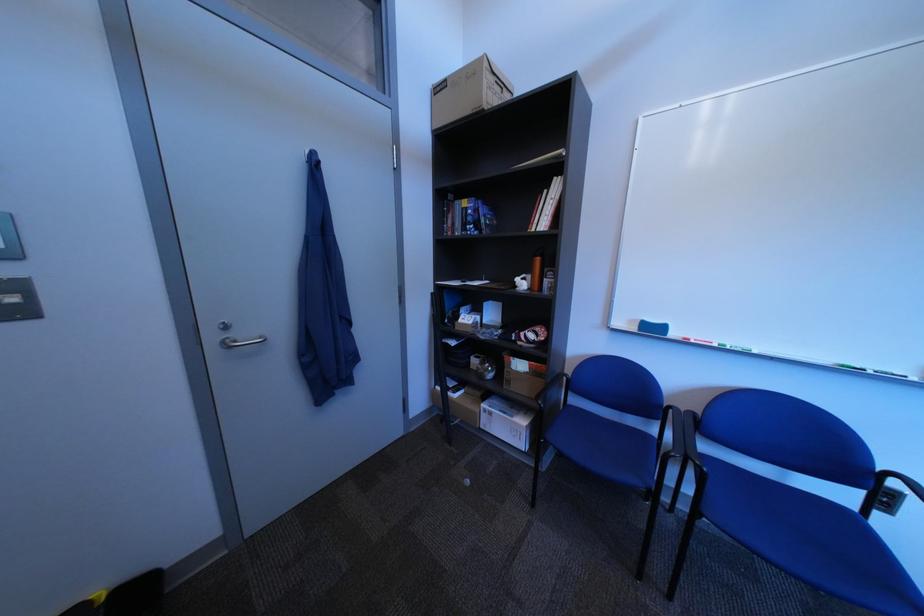
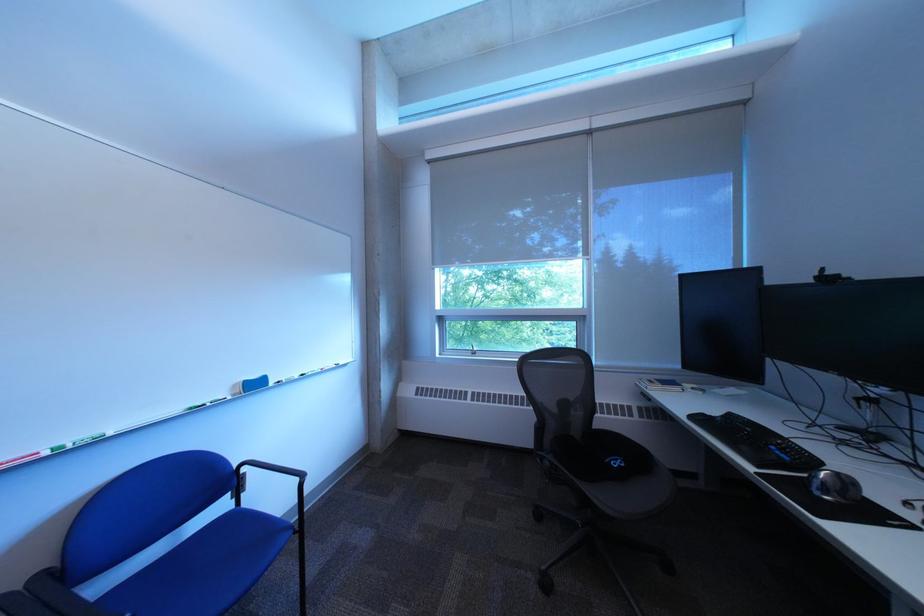
The point at (870, 511) is marked in the first image. Where is the corresponding point in the second image?

(248, 508)